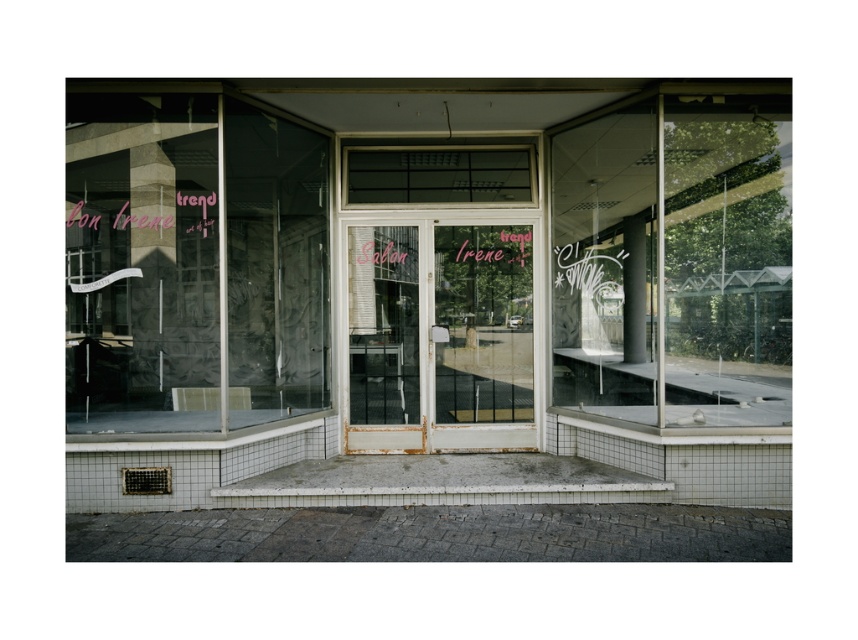
Who is lower down, transparent glass storefront at center or transparent glass window at center?

transparent glass storefront at center

Is transparent glass storefront at center to the right of transparent glass window at center from the viewer's perspective?

Incorrect, transparent glass storefront at center is not on the right side of transparent glass window at center.

Is point (334, 404) positioned behind point (716, 209)?

No, it is not.

At what (x,y) coordinates should I click in order to perform the action: click on transparent glass storefront at center. Please return your answer as a coordinate pair (x, y). This screenshot has height=640, width=858. Looking at the image, I should click on (427, 284).

Measure the distance from transparent glass at left to transparent glass window at center.

A distance of 5.05 meters exists between transparent glass at left and transparent glass window at center.

Who is more forward, (136, 342) or (674, 364)?

Point (136, 342)

Does point (139, 180) lie in front of point (752, 120)?

Yes.

This screenshot has width=858, height=640. In order to click on transparent glass at left in this screenshot , I will do `click(192, 264)`.

Is transparent glass at left behind rusty metal screen door at center?

No, it is in front of rusty metal screen door at center.

Is transparent glass at left closer to camera compared to rusty metal screen door at center?

Yes.

At what (x,y) coordinates should I click in order to perform the action: click on transparent glass at left. Please return your answer as a coordinate pair (x, y). Image resolution: width=858 pixels, height=640 pixels. Looking at the image, I should click on tap(192, 264).

This screenshot has height=640, width=858. What are the coordinates of `transparent glass at left` in the screenshot? It's located at [x=192, y=264].